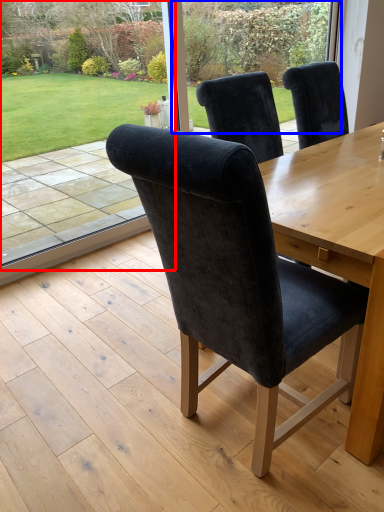
Question: Which point is further to the camera, window screen (highlighted by a red box) or glass door (highlighted by a blue box)?

Choices:
 (A) window screen
 (B) glass door

Answer: (B)